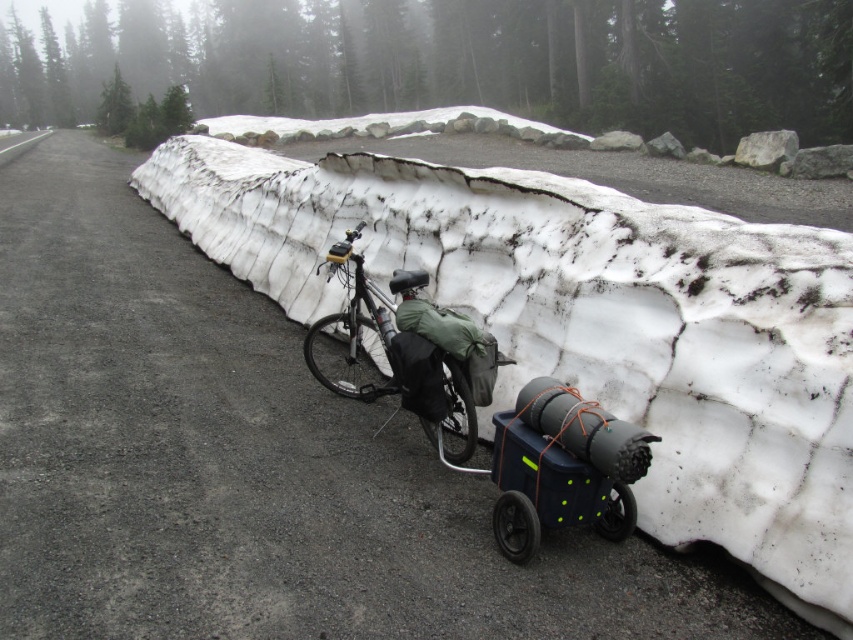
Looking at this image, which is below, blue plastic cart at center or matte black bicycle at center?

Positioned lower is blue plastic cart at center.

Which is in front, point (540, 452) or point (338, 253)?

Point (540, 452)

Between point (608, 448) and point (363, 276), which one is positioned behind?

Point (363, 276)

What are the coordinates of `blue plastic cart at center` in the screenshot? It's located at (561, 467).